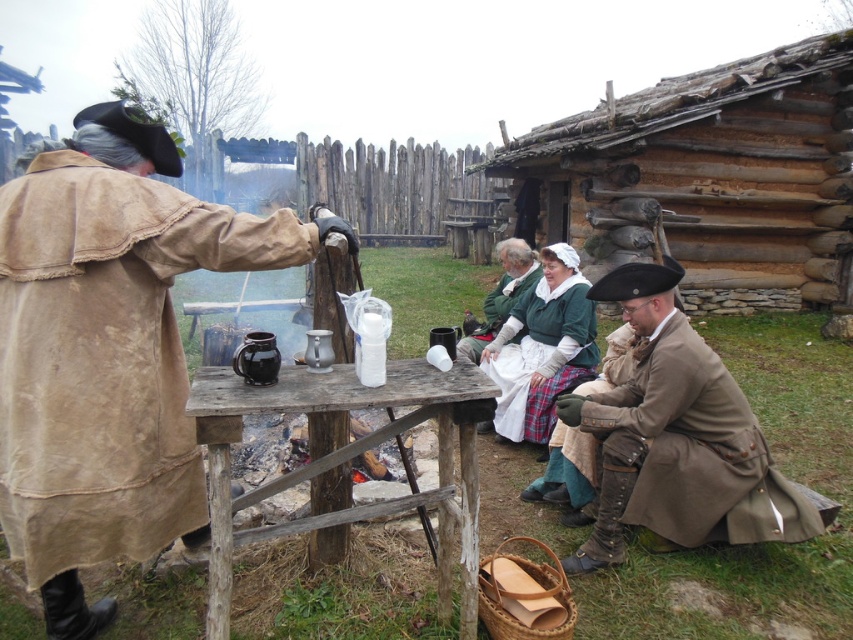
Question: Which point is closer to the camera?

Choices:
 (A) white cotton apron at center
 (B) wooden table at center
 (C) green woolen robe at center

Answer: (B)

Question: Which is nearer to the green woolen robe at center?

Choices:
 (A) white cotton apron at center
 (B) wooden table at center
 (C) brown leather robe at lower right
 (D) beige suede robe at left

Answer: (A)

Question: Which point appears farthest from the camera in this image?

Choices:
 (A) (100, 166)
 (B) (308, 406)
 (C) (525, 371)

Answer: (C)

Question: Does beige suede robe at left have a greater width compared to brown leather robe at lower right?

Choices:
 (A) no
 (B) yes

Answer: (A)

Question: Does beige suede robe at left appear over green woolen robe at center?

Choices:
 (A) yes
 (B) no

Answer: (B)

Question: Does white cotton apron at center come in front of green woolen robe at center?

Choices:
 (A) yes
 (B) no

Answer: (A)